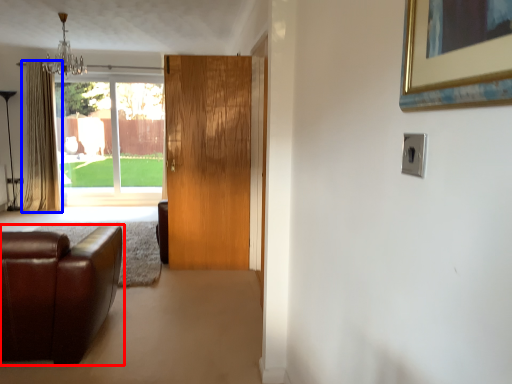
Question: Which object appears farthest to the camera in this image, studio couch (highlighted by a red box) or curtain (highlighted by a blue box)?

Choices:
 (A) studio couch
 (B) curtain

Answer: (B)